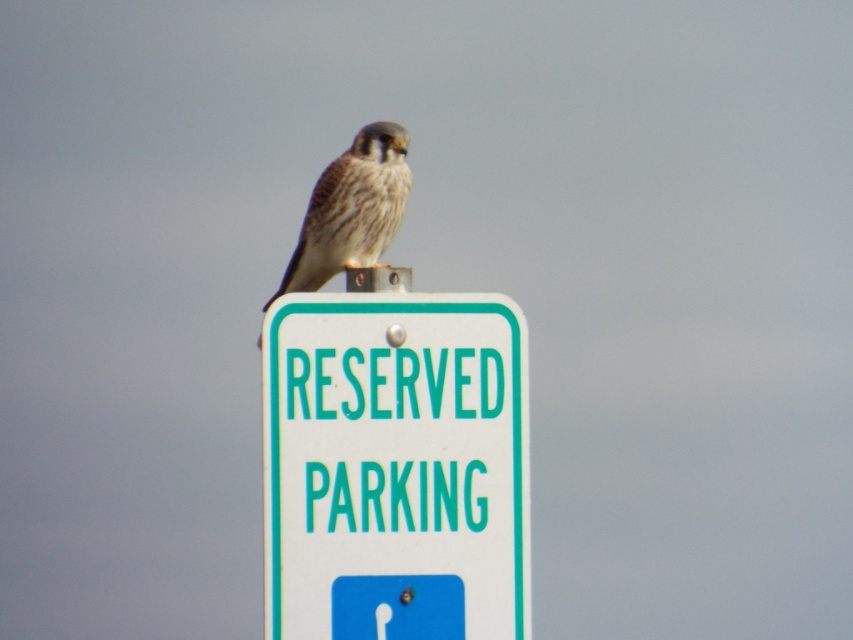
Question: Is white plastic sign at center above speckled feathered falcon at center?

Choices:
 (A) no
 (B) yes

Answer: (A)

Question: Which of the following is the closest to the observer?

Choices:
 (A) speckled feathered falcon at center
 (B) white plastic sign at center

Answer: (B)

Question: Which point is closer to the camera taking this photo?

Choices:
 (A) (442, 444)
 (B) (393, 218)

Answer: (A)

Question: Can you confirm if white plastic sign at center is thinner than speckled feathered falcon at center?

Choices:
 (A) yes
 (B) no

Answer: (B)

Question: Is the position of white plastic sign at center more distant than that of speckled feathered falcon at center?

Choices:
 (A) no
 (B) yes

Answer: (A)